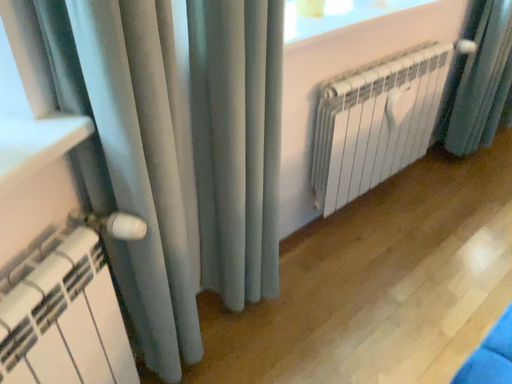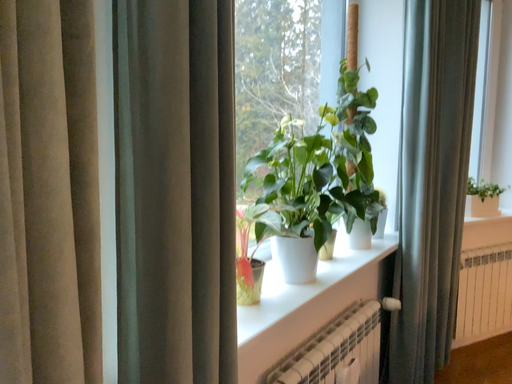
Question: Which way did the camera rotate in the video?

Choices:
 (A) rotated downward
 (B) rotated upward

Answer: (B)